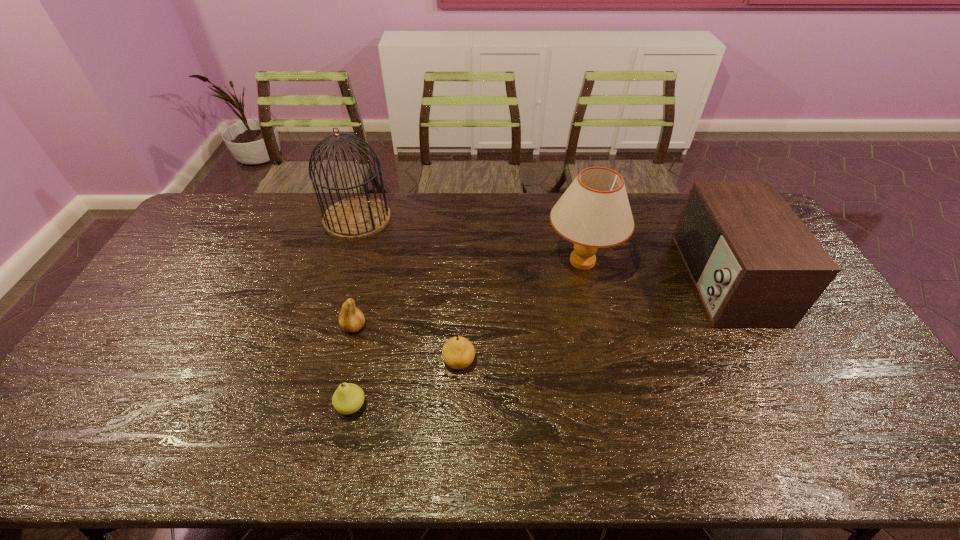
Identify the location of empty space that is in between the birdcage and the farthest pear. (356, 272).

This screenshot has height=540, width=960. Find the location of `empty space between the lampshade and the farthest pear`. empty space between the lampshade and the farthest pear is located at coordinates (468, 294).

Select which object is the third closest to the lampshade. Please provide its 2D coordinates. Your answer should be formatted as a tuple, i.e. [(x, y)], where the tuple contains the x and y coordinates of a point satisfying the conditions above.

[(357, 217)]

In order to click on object that ranks as the third closest to the farthest pear in this screenshot , I will do 357,217.

Identify which pear is the second closest to the birdcage. Please provide its 2D coordinates. Your answer should be formatted as a tuple, i.e. [(x, y)], where the tuple contains the x and y coordinates of a point satisfying the conditions above.

[(458, 352)]

The height and width of the screenshot is (540, 960). Identify the location of the second closest pear to the nearest object. (458, 352).

Find the location of a particular element. The width and height of the screenshot is (960, 540). vacant region that satisfies the following two spatial constraints: 1. on the front-facing side of the radio receiver; 2. on the front side of the nearest pear is located at coordinates (791, 406).

Where is `free space that satisfies the following two spatial constraints: 1. on the back side of the fifth object from left to right; 2. at the door of the birdcage`? The height and width of the screenshot is (540, 960). free space that satisfies the following two spatial constraints: 1. on the back side of the fifth object from left to right; 2. at the door of the birdcage is located at coordinates (572, 218).